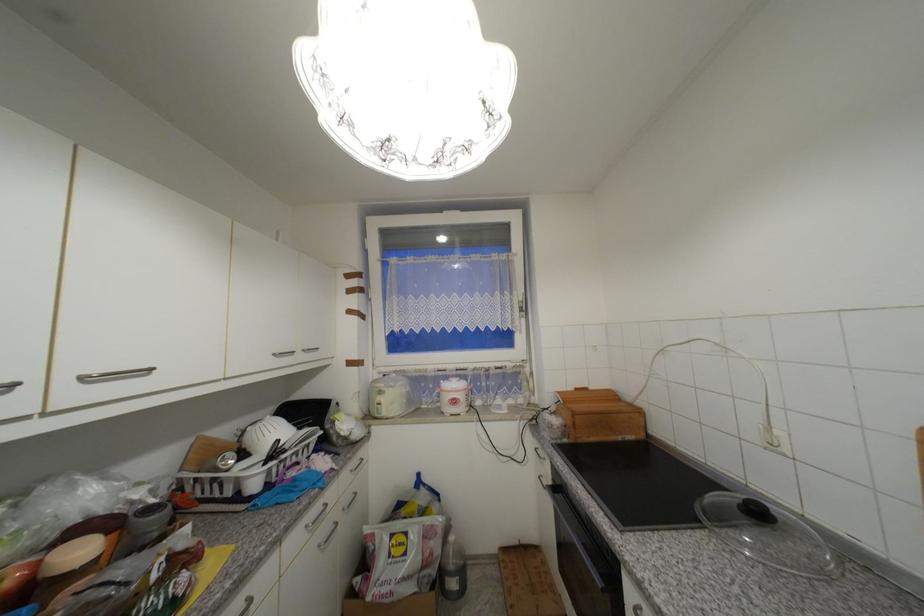
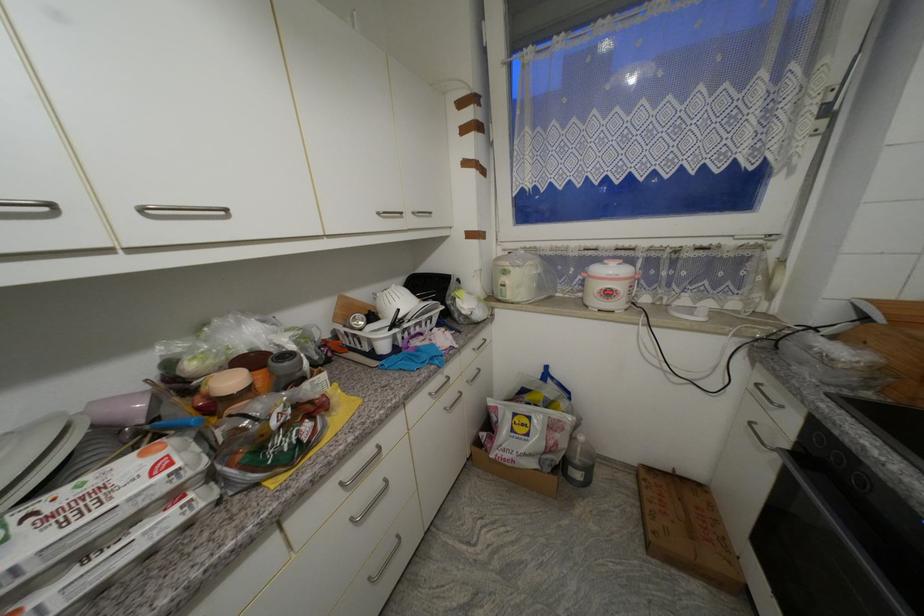
Find the pixel in the second image that matches point (330, 531) in the first image.

(455, 398)